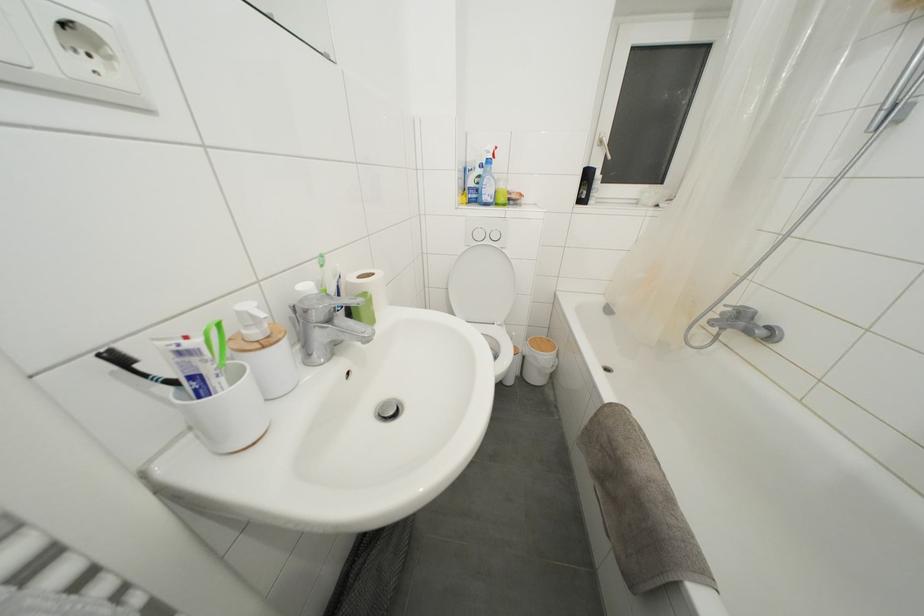
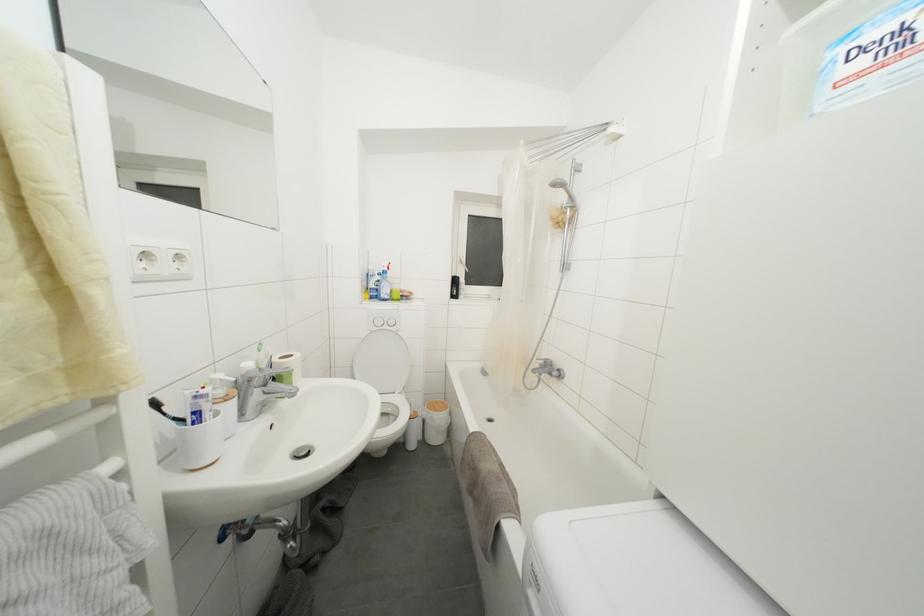
In the second image, find the point that corresponds to the point at 185,358 in the first image.

(200, 402)